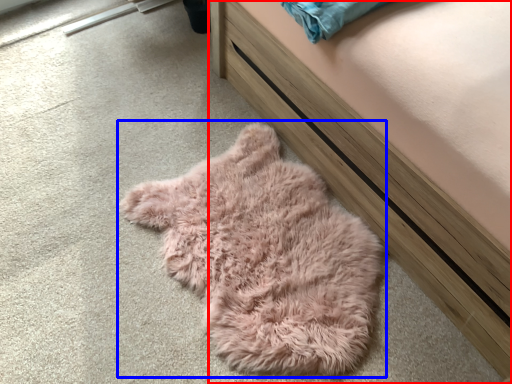
Question: Which of the following is the closest to the observer, furniture (highlighted by a red box) or sleeping bag (highlighted by a blue box)?

Choices:
 (A) furniture
 (B) sleeping bag

Answer: (A)